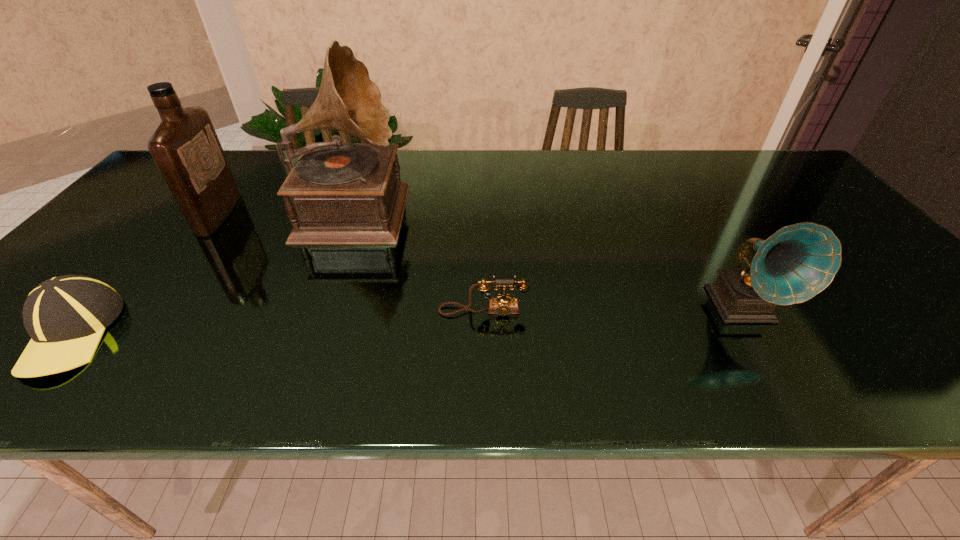
Where is `empty space between the third object from right to left and the second object from right to left`? The width and height of the screenshot is (960, 540). empty space between the third object from right to left and the second object from right to left is located at coordinates (419, 259).

The height and width of the screenshot is (540, 960). What are the coordinates of `object that can be found as the third closest to the rightmost object` in the screenshot? It's located at (185, 147).

Select which object appears as the fourth closest to the rightmost object. Please provide its 2D coordinates. Your answer should be formatted as a tuple, i.e. [(x, y)], where the tuple contains the x and y coordinates of a point satisfying the conditions above.

[(65, 316)]